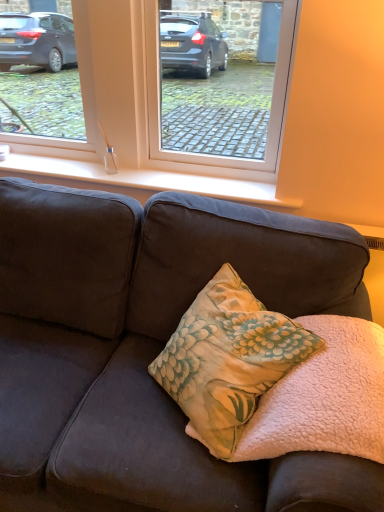
You are a GUI agent. You are given a task and a screenshot of the screen. Output one action in this format:
    pyautogui.click(x=<x>, y=<y>)
    Task: Click on the fluffy pink blanket at center
    This screenshot has width=384, height=512.
    Given the screenshot: What is the action you would take?
    pyautogui.click(x=325, y=397)

The height and width of the screenshot is (512, 384). What do you see at coordinates (228, 358) in the screenshot? I see `floral fabric pillow at center` at bounding box center [228, 358].

Locate an element on the screen. The image size is (384, 512). matte glass window at upper center is located at coordinates (151, 94).

Is the surface of matte glass window at upper center in direct contact with floral fabric pillow at center?

No, matte glass window at upper center is not making contact with floral fabric pillow at center.

Considering the positions of points (147, 118) and (202, 352), is point (147, 118) farther from camera compared to point (202, 352)?

Yes, point (147, 118) is behind point (202, 352).

Is matte glass window at upper center taller than floral fabric pillow at center?

Yes.

Which object is positioned more to the left, matte glass window at upper center or floral fabric pillow at center?

matte glass window at upper center.

Which is more to the left, fluffy pink blanket at center or white glossy glass at center?

From the viewer's perspective, white glossy glass at center appears more on the left side.

Which of these two, fluffy pink blanket at center or white glossy glass at center, is smaller?

Smaller between the two is white glossy glass at center.

Which point is more distant from viewer, [349,387] or [64,150]?

Positioned behind is point [64,150].

Find the location of a particular element. This screenshot has width=384, height=512. window sill above the fluffy pink blanket at center (from a real-world perspective) is located at coordinates (138, 180).

Does matte glass window at upper center have a lesser width compared to white glossy glass at center?

Yes, matte glass window at upper center is thinner than white glossy glass at center.

From the image's perspective, is matte glass window at upper center below white glossy glass at center?

No, from the image's perspective, matte glass window at upper center is not below white glossy glass at center.

Would you say white glossy glass at center is part of matte glass window at upper center's contents?

No.

Can you confirm if fluffy pink blanket at center is wider than floral fabric pillow at center?

Yes.

Looking at this image, who is more distant, fluffy pink blanket at center or floral fabric pillow at center?

floral fabric pillow at center is behind.

Is fluffy pink blanket at center far from floral fabric pillow at center?

fluffy pink blanket at center is actually quite close to floral fabric pillow at center.

Considering their positions, is matte glass window at upper center located in front of or behind fluffy pink blanket at center?

Visually, matte glass window at upper center is located behind fluffy pink blanket at center.

Which of these two, matte glass window at upper center or fluffy pink blanket at center, stands shorter?

fluffy pink blanket at center is shorter.

Does matte glass window at upper center appear on the right side of fluffy pink blanket at center?

Incorrect, matte glass window at upper center is not on the right side of fluffy pink blanket at center.

From a real-world perspective, is white glossy glass at center over matte glass window at upper center?

No, from a real-world perspective, white glossy glass at center is not over matte glass window at upper center

Can you confirm if white glossy glass at center is smaller than matte glass window at upper center?

Yes, white glossy glass at center is smaller than matte glass window at upper center.

Considering the relative sizes of white glossy glass at center and matte glass window at upper center in the image provided, is white glossy glass at center thinner than matte glass window at upper center?

Incorrect, the width of white glossy glass at center is not less than that of matte glass window at upper center.

Is fluffy pink blanket at center looking in the opposite direction of matte glass window at upper center?

fluffy pink blanket at center does not have its back to matte glass window at upper center.

Between fluffy pink blanket at center and matte glass window at upper center, which one has larger size?

matte glass window at upper center is bigger.

Considering the sizes of objects fluffy pink blanket at center and matte glass window at upper center in the image provided, who is shorter, fluffy pink blanket at center or matte glass window at upper center?

Standing shorter between the two is fluffy pink blanket at center.

This screenshot has width=384, height=512. In the image, there is a matte glass window at upper center. What are the coordinates of `pillow below it (from a real-world perspective)` in the screenshot? It's located at (228, 358).

You are a GUI agent. You are given a task and a screenshot of the screen. Output one action in this format:
    pyautogui.click(x=<x>, y=<y>)
    Task: Click on the window sill lying above the fluffy pink blanket at center (from the image's perspective)
    This screenshot has width=384, height=512.
    Given the screenshot: What is the action you would take?
    pyautogui.click(x=138, y=180)

From the image, which object appears to be farther from floral fabric pillow at center, fluffy pink blanket at center or matte glass window at upper center?

matte glass window at upper center.

Considering their positions, is fluffy pink blanket at center positioned closer to matte glass window at upper center than floral fabric pillow at center?

floral fabric pillow at center lies closer to matte glass window at upper center than the other object.

Based on their spatial positions, is matte glass window at upper center or floral fabric pillow at center further from fluffy pink blanket at center?

The object further to fluffy pink blanket at center is matte glass window at upper center.

From the image, which object appears to be farther from matte glass window at upper center, fluffy pink blanket at center or white glossy glass at center?

fluffy pink blanket at center is positioned further to the anchor matte glass window at upper center.

From the image, which object appears to be farther from fluffy pink blanket at center, matte glass window at upper center or white glossy glass at center?

matte glass window at upper center is further to fluffy pink blanket at center.

Looking at the image, which one is located further to white glossy glass at center, matte glass window at upper center or fluffy pink blanket at center?

fluffy pink blanket at center lies further to white glossy glass at center than the other object.

When comparing their distances from floral fabric pillow at center, does white glossy glass at center or fluffy pink blanket at center seem further?

The object further to floral fabric pillow at center is white glossy glass at center.

Which object lies further to the anchor point white glossy glass at center, matte glass window at upper center or floral fabric pillow at center?

floral fabric pillow at center is further to white glossy glass at center.

The height and width of the screenshot is (512, 384). Find the location of `pillow that lies between matte glass window at upper center and fluffy pink blanket at center from top to bottom`. pillow that lies between matte glass window at upper center and fluffy pink blanket at center from top to bottom is located at coordinates (228, 358).

In order to click on window sill between matte glass window at upper center and floral fabric pillow at center in the vertical direction in this screenshot , I will do `click(138, 180)`.

This screenshot has width=384, height=512. In order to click on window sill between matte glass window at upper center and fluffy pink blanket at center vertically in this screenshot , I will do `click(138, 180)`.

Where is `pillow between fluffy pink blanket at center and white glossy glass at center in the front-back direction`? pillow between fluffy pink blanket at center and white glossy glass at center in the front-back direction is located at coordinates (228, 358).